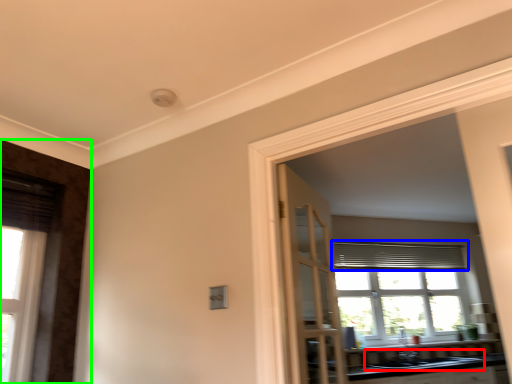
Question: Estimate the real-world distances between objects in this image. Which object is closer to sink (highlighted by a red box), curtain (highlighted by a blue box) or door (highlighted by a green box)?

Choices:
 (A) curtain
 (B) door

Answer: (A)